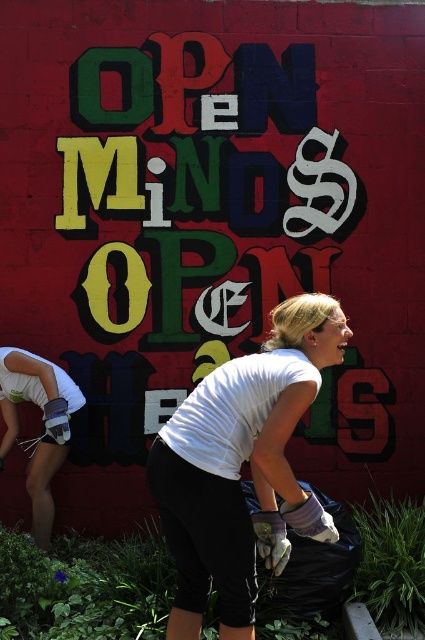
You are a photographer trying to capture the volunteer in the scene. To ensure the white matte shirt at center and white matte gloves at lower left are both clearly visible in the photo, which object should you focus on first?

The white matte shirt at center is taller than the white matte gloves at lower left, so you should focus on the white matte shirt at center first to ensure both are in clear view.

Looking at this image, you are a photographer standing at the edge of the scene. You want to take a photo that includes both the white matte shirt at center and the white matte gloves at lower left. What is the minimum distance you need to move backward to ensure both objects are in frame?

The minimum distance you need to move backward is 5.70 feet to ensure both the white matte shirt at center and the white matte gloves at lower left are in frame, as they are 5.70 feet apart.